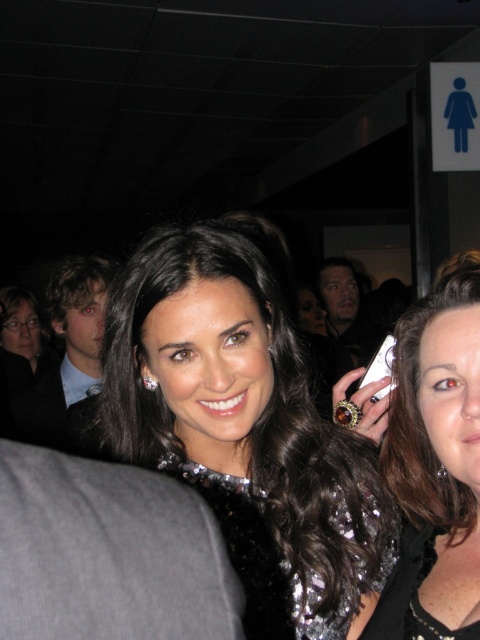
Measure the distance between shiny black dress at center and satin black dress at center.

The distance of shiny black dress at center from satin black dress at center is 5.76 inches.

Is shiny black dress at center bigger than satin black dress at center?

Yes.

Is point (251, 556) closer to camera compared to point (468, 513)?

Yes, point (251, 556) is closer to viewer.

Find the location of a particular element. Image resolution: width=480 pixels, height=640 pixels. shiny black dress at center is located at coordinates (241, 429).